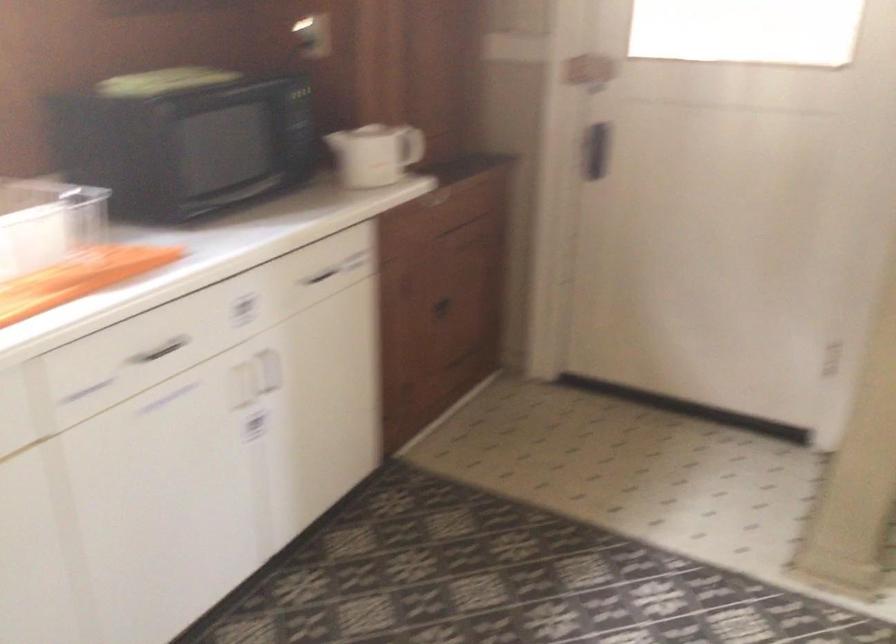
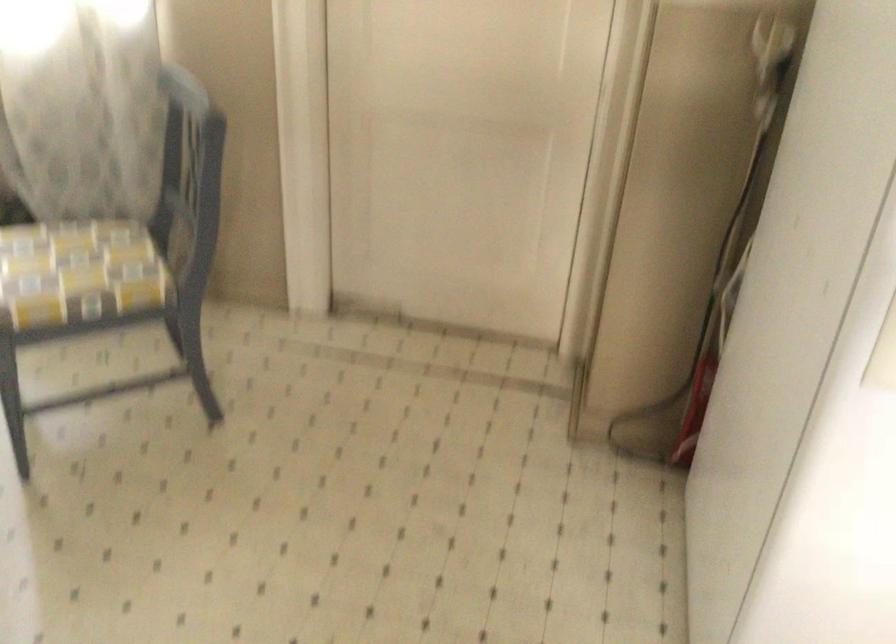
The images are taken continuously from a first-person perspective. In which direction is your viewpoint rotating?

The camera's rotation is toward right-down.